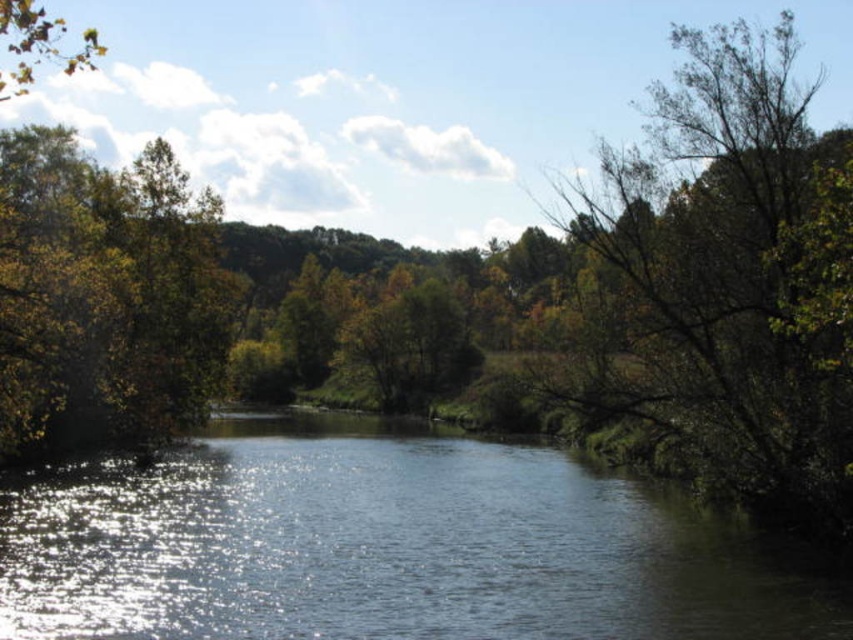
You are standing at the edge of the river and want to cross to the other side. There is a clear water at center and a green leafy tree at right. Which object is closer to your current position?

The clear water at center is positioned on the left side of green leafy tree at right, so the clear water at center is closer to your current position.

You are a hiker who wants to cross the river using a 15 meter long rope bridge. The bridge is anchored between the clear water at center and the green leafy tree at right. Will the bridge reach from the tree to the water?

The distance between the clear water at center and the green leafy tree at right is 14.64 meters, so a 15 meter long rope bridge will be sufficient to span the gap between the clear water at center and the green leafy tree at right.